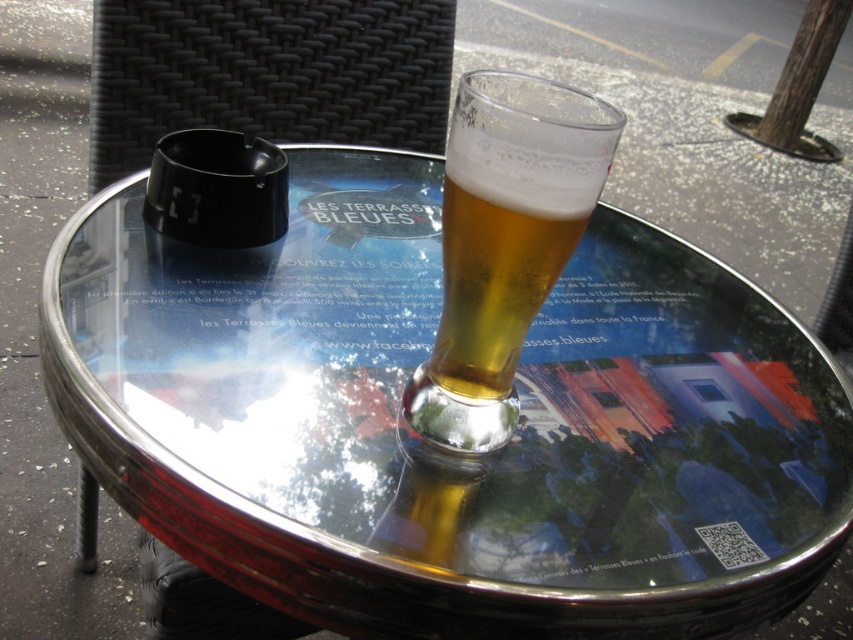
Between transparent glass table at center and translucent glass beer at center, which one appears on the right side from the viewer's perspective?

From the viewer's perspective, transparent glass table at center appears more on the right side.

This screenshot has width=853, height=640. Find the location of `transparent glass table at center`. transparent glass table at center is located at coordinates (445, 458).